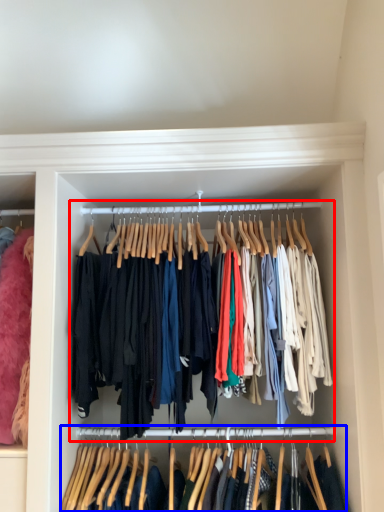
Question: Which object is closer to the camera taking this photo, closet (highlighted by a red box) or closet (highlighted by a blue box)?

Choices:
 (A) closet
 (B) closet

Answer: (B)